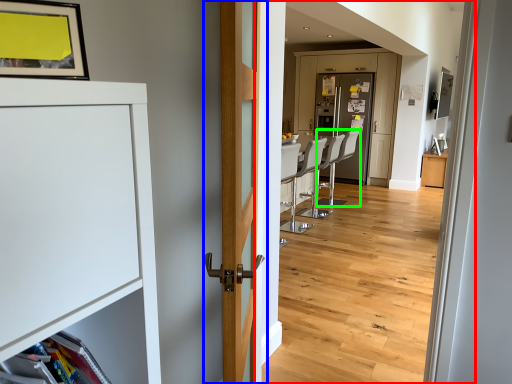
Question: Which object is positioned farthest from corridor (highlighted by a red box)? Select from door (highlighted by a blue box) and armchair (highlighted by a green box).

Choices:
 (A) door
 (B) armchair

Answer: (A)